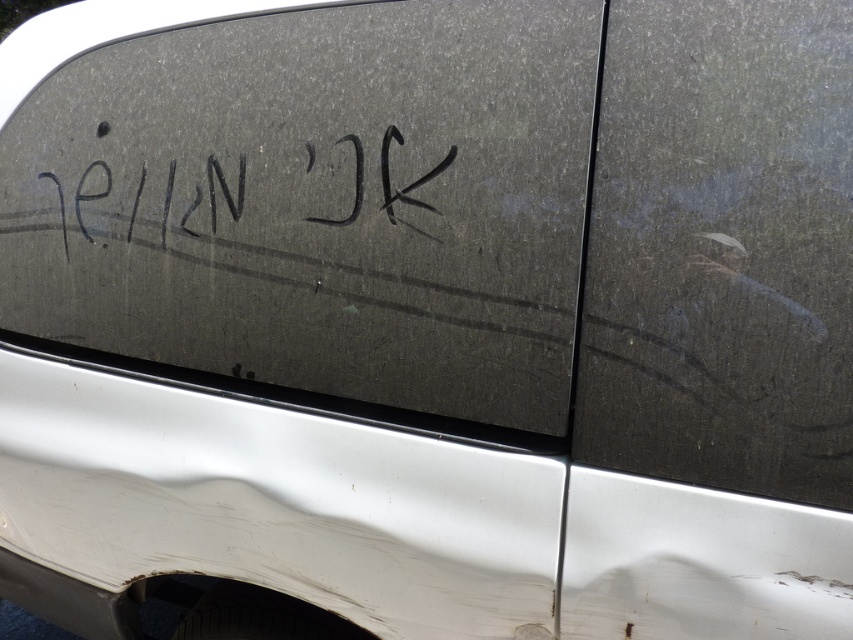
Question: Which point is farther to the camera?

Choices:
 (A) (561, 244)
 (B) (630, 54)
 (C) (390, 211)

Answer: (C)

Question: Is matte black window at center smaller than matte black glass at center?

Choices:
 (A) yes
 (B) no

Answer: (B)

Question: Which point is closer to the camera?

Choices:
 (A) (660, 44)
 (B) (308, 145)
 (C) (540, 406)

Answer: (A)

Question: Among these objects, which one is nearest to the camera?

Choices:
 (A) black ink writing at center
 (B) matte black glass at center
 (C) matte black window at center

Answer: (B)

Question: Does matte black window at center come behind matte black glass at center?

Choices:
 (A) no
 (B) yes

Answer: (B)

Question: Where is matte black window at center located in relation to black ink writing at center in the image?

Choices:
 (A) right
 (B) left

Answer: (A)